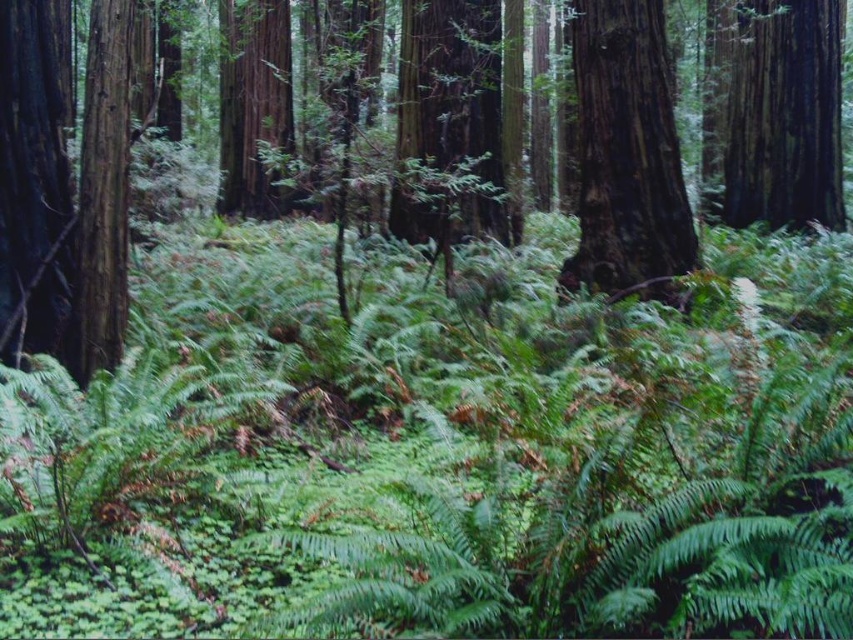
You are standing in a forest and want to take a photo of the smooth dark brown tree trunk at center. If your camera has a maximum focus range of 8 meters, will you need to move closer to capture it clearly?

The smooth dark brown tree trunk at center is 8.57 meters away from the viewer, which exceeds the camera maximum focus range of 8 meters. You need to move closer to capture it clearly.

You are a hiker in the forest and want to identify the largest tree trunk in the area. Which one between the smooth bark tree at center and the smooth dark brown tree trunk at center is larger?

The smooth bark tree at center is bigger than the smooth dark brown tree trunk at center, so it is the larger one.